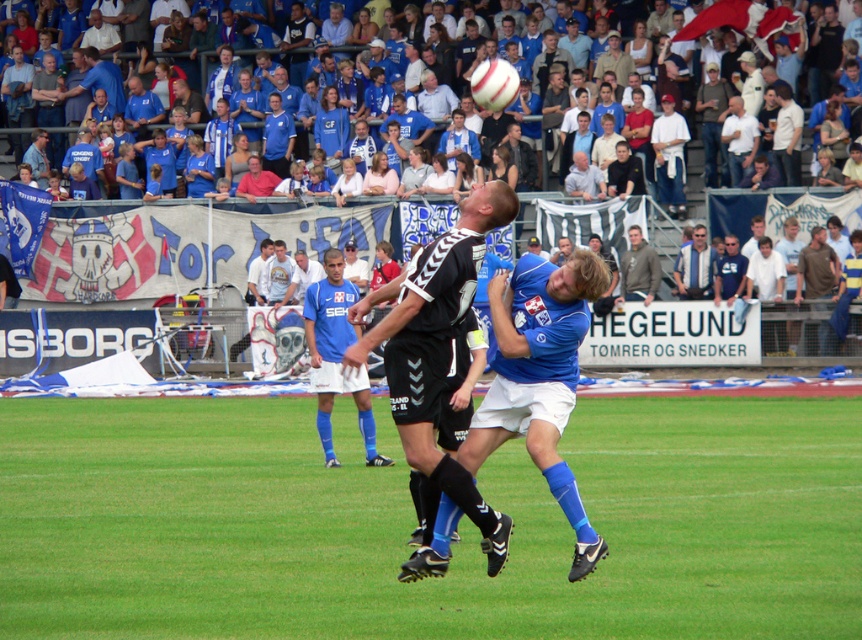
Between striped shirt at center and gray hoodie at center, which one is positioned lower?

gray hoodie at center is below.

Can you confirm if striped shirt at center is wider than gray hoodie at center?

Correct, the width of striped shirt at center exceeds that of gray hoodie at center.

Between point (675, 259) and point (646, 243), which one is positioned behind?

The point (675, 259) is more distant.

Locate an element on the screen. The width and height of the screenshot is (862, 640). striped shirt at center is located at coordinates (695, 268).

Who is positioned more to the left, striped shirt at center or blue fabric at upper center?

Positioned to the left is blue fabric at upper center.

Does striped shirt at center have a larger size compared to blue fabric at upper center?

No, striped shirt at center is not bigger than blue fabric at upper center.

What do you see at coordinates (695, 268) in the screenshot? The width and height of the screenshot is (862, 640). I see `striped shirt at center` at bounding box center [695, 268].

I want to click on striped shirt at center, so click(695, 268).

Which is behind, point (623, 268) or point (767, 22)?

The point (767, 22) is behind.

What do you see at coordinates (639, 268) in the screenshot? The height and width of the screenshot is (640, 862). I see `gray hoodie at center` at bounding box center [639, 268].

Is point (642, 280) closer to viewer compared to point (55, 129)?

That is True.

Image resolution: width=862 pixels, height=640 pixels. I want to click on gray hoodie at center, so click(639, 268).